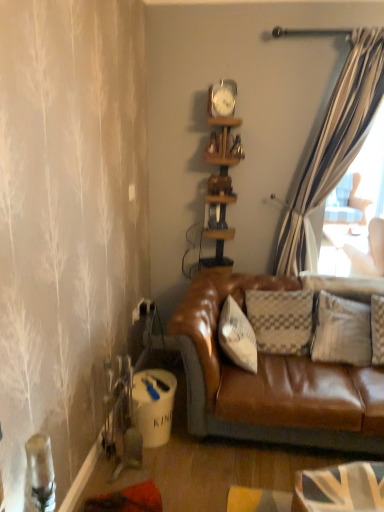
Question: Can you confirm if wooden clock at upper center, placed as the second shelf when sorted from bottom to top, is taller than metallic silver clock at upper center?

Choices:
 (A) no
 (B) yes

Answer: (A)

Question: Is wooden clock at upper center, placed as the second shelf when sorted from bottom to top, turned away from metallic silver clock at upper center?

Choices:
 (A) no
 (B) yes

Answer: (A)

Question: From a real-world perspective, is wooden clock at upper center, which is counted as the first shelf, starting from the top, located higher than metallic silver clock at upper center?

Choices:
 (A) no
 (B) yes

Answer: (A)

Question: Does wooden clock at upper center, which is counted as the first shelf, starting from the top, come behind metallic silver clock at upper center?

Choices:
 (A) yes
 (B) no

Answer: (A)

Question: Is metallic silver clock at upper center a part of wooden clock at upper center, which is counted as the first shelf, starting from the top?

Choices:
 (A) no
 (B) yes

Answer: (A)

Question: From a real-world perspective, is wooden clock at upper center, placed as the second shelf when sorted from bottom to top, physically below metallic silver clock at upper center?

Choices:
 (A) yes
 (B) no

Answer: (A)

Question: Is wooden clock at upper center, placed as the second shelf when sorted from bottom to top, completely or partially outside of wooden shelf at center, the first shelf in the bottom-to-top sequence?

Choices:
 (A) yes
 (B) no

Answer: (B)

Question: Is the surface of wooden clock at upper center, placed as the second shelf when sorted from bottom to top, in direct contact with wooden shelf at center, which appears as the 2th shelf when viewed from the top?

Choices:
 (A) yes
 (B) no

Answer: (B)

Question: Does wooden clock at upper center, which is counted as the first shelf, starting from the top, have a smaller size compared to wooden shelf at center, the first shelf in the bottom-to-top sequence?

Choices:
 (A) no
 (B) yes

Answer: (B)

Question: From a real-world perspective, is wooden clock at upper center, which is counted as the first shelf, starting from the top, located higher than wooden shelf at center, the first shelf in the bottom-to-top sequence?

Choices:
 (A) yes
 (B) no

Answer: (A)

Question: From a real-world perspective, is wooden clock at upper center, which is counted as the first shelf, starting from the top, positioned under wooden shelf at center, which appears as the 2th shelf when viewed from the top, based on gravity?

Choices:
 (A) no
 (B) yes

Answer: (A)

Question: Considering the relative sizes of wooden clock at upper center, placed as the second shelf when sorted from bottom to top, and wooden shelf at center, which appears as the 2th shelf when viewed from the top, in the image provided, is wooden clock at upper center, placed as the second shelf when sorted from bottom to top, shorter than wooden shelf at center, which appears as the 2th shelf when viewed from the top,?

Choices:
 (A) yes
 (B) no

Answer: (A)

Question: Considering the relative sizes of wooden shelf at center, which appears as the 2th shelf when viewed from the top, and wooden clock at upper center, which is counted as the first shelf, starting from the top, in the image provided, is wooden shelf at center, which appears as the 2th shelf when viewed from the top, smaller than wooden clock at upper center, which is counted as the first shelf, starting from the top,?

Choices:
 (A) yes
 (B) no

Answer: (B)